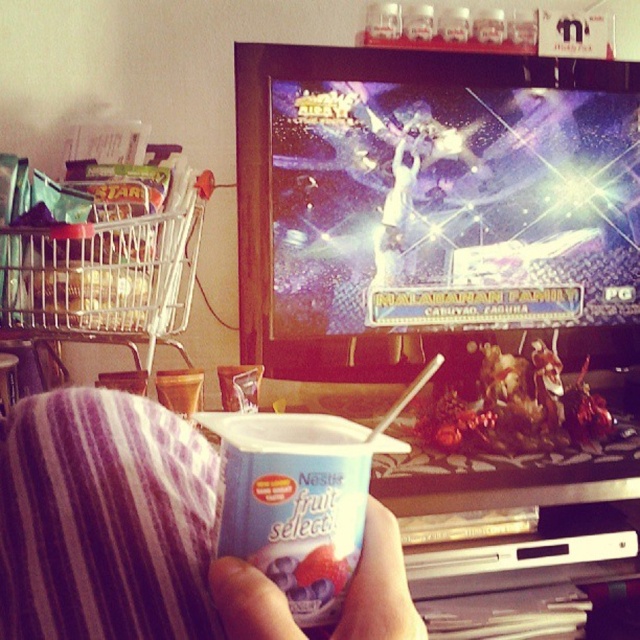
You are a photographer trying to capture a closeup of the white matte cup at lower center without the purple striped fabric at lower left blocking the view. Can you adjust your camera angle to achieve this?

The purple striped fabric at lower left is located above the white matte cup at lower center, so tilting the camera downward slightly would allow you to frame the white matte cup at lower center without the fabric blocking the view.

You are a person who wants to place a white matte cup at lower center on the table without moving the purple striped fabric at lower left. Is this possible?

The purple striped fabric at lower left is positioned on the left side of white matte cup at lower center, so there is space to place the white matte cup at lower center on the table without moving the purple striped fabric at lower left.